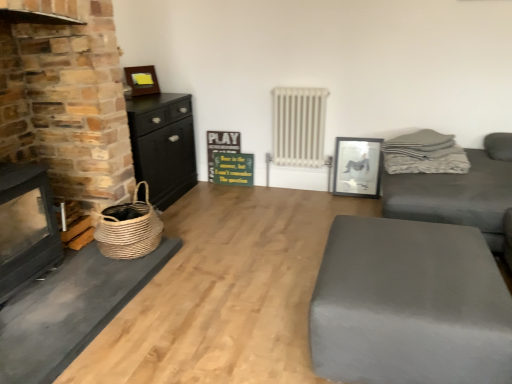
At what (x,y) coordinates should I click in order to perform the action: click on vacant area that lies in front of woven straw basket at left. Please return your answer as a coordinate pair (x, y). Looking at the image, I should click on (97, 277).